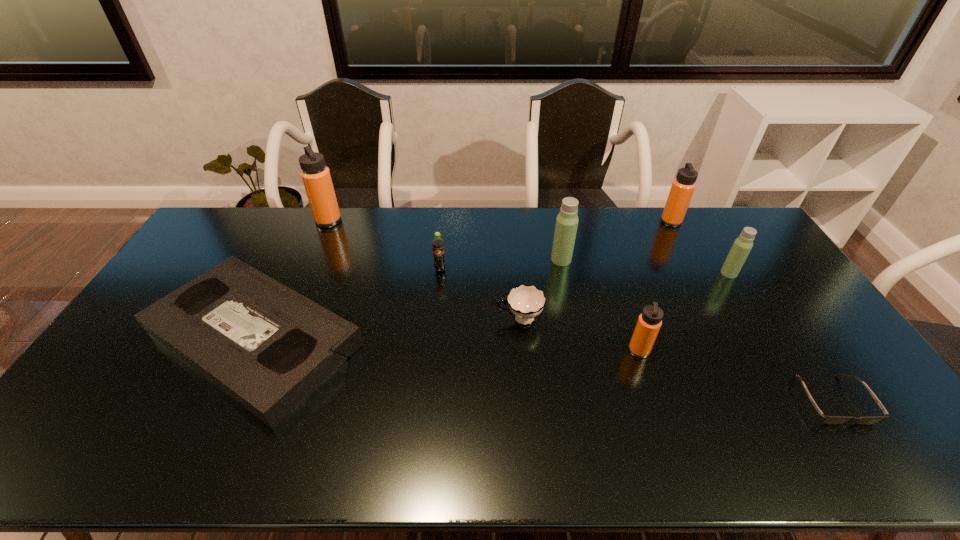
The image size is (960, 540). Find the location of `free space located on the left of the fourth farthest thermos bottle`. free space located on the left of the fourth farthest thermos bottle is located at coordinates 700,273.

The image size is (960, 540). What are the coordinates of `free spot located 0.290m on the right of the fourth object from right to left` in the screenshot? It's located at (752, 350).

Locate an element on the screen. vacant area situated 0.190m on the front label of the fourth shortest object is located at coordinates (436, 315).

Locate an element on the screen. This screenshot has height=540, width=960. free space located on the side of the third shortest object with the handle is located at coordinates (473, 319).

Find the location of a particular element. This screenshot has width=960, height=540. free space located 0.240m on the side of the third shortest object with the handle is located at coordinates 417,319.

The image size is (960, 540). Identify the location of vacant space positioned 0.360m on the side of the third shortest object with the handle. (377, 319).

Identify the location of free space located 0.350m on the back of the videotape. Image resolution: width=960 pixels, height=540 pixels. (314, 213).

Find the location of a particular element. The height and width of the screenshot is (540, 960). vacant region located 0.070m on the front-facing side of the shortest object is located at coordinates (869, 455).

Where is `object that is at the left edge`? Image resolution: width=960 pixels, height=540 pixels. object that is at the left edge is located at coordinates (269, 348).

Identify the location of object present at the right edge. Image resolution: width=960 pixels, height=540 pixels. (828, 420).